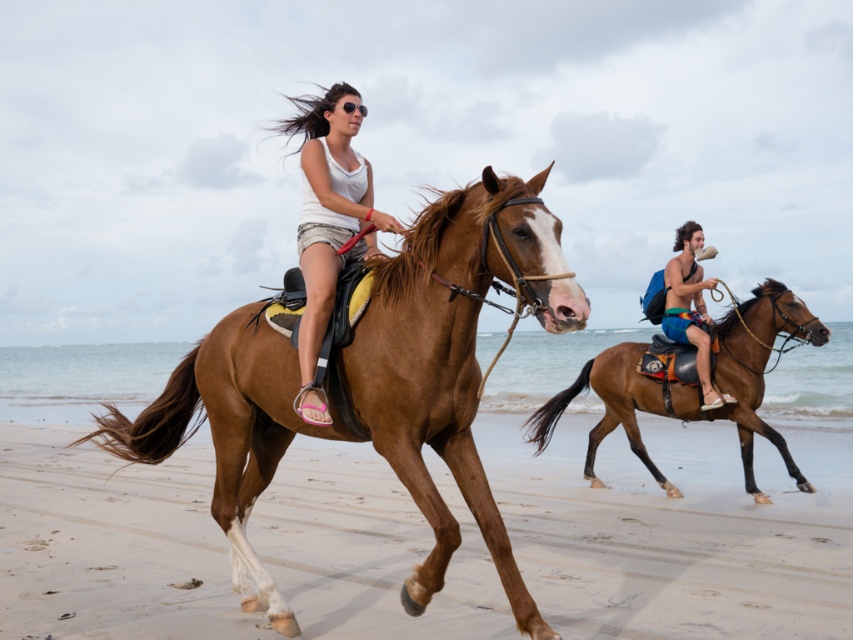
Based on the photo, you are a photographer standing on the beach. You want to take a photo of the blue fabric shorts at center and the blue fabric backpack at right. Which object should you focus on first if you want to capture both in the same frame without moving the camera?

The blue fabric shorts at center is positioned under blue fabric backpack at right, so you should focus on the blue fabric backpack at right first since it is higher in the frame.

You are a photographer trying to capture a clear shot of the matte white tank top at center and the blue fabric backpack at right. Which object should you zoom in on to ensure it appears more detailed in the photo?

The matte white tank top at center is larger in size than the blue fabric backpack at right, so zooming in on the matte white tank top at center will ensure it appears more detailed in the photo.